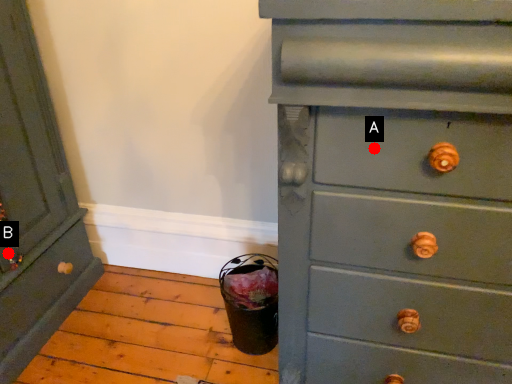
Question: Two points are circled on the image, labeled by A and B beside each circle. Which point is closer to the camera?

Choices:
 (A) A is closer
 (B) B is closer

Answer: (A)